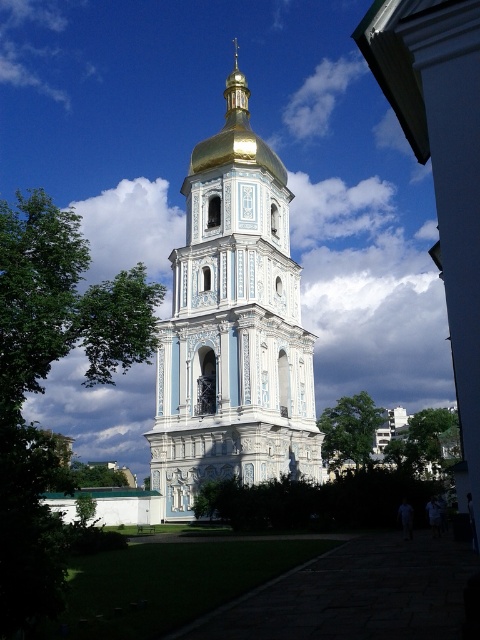
You are standing in front of the bell tower and want to take a photo that includes both the golden dome and the green leafy tree at center. Given that your camera has a maximum zoom range of 100 feet, can you capture both elements in the same frame without moving closer?

The green leafy tree at center is 288.00 feet away from the viewer. Since the camera can only zoom up to 100 feet, it cannot capture both the golden dome and the green leafy tree at center in the same frame without moving closer.

You are standing at the base of the light blue bell tower with the golden dome. You want to take a photo that includes both the green leafy tree at left and the golden dome. Which direction should you face to ensure both are in the frame?

The green leafy tree at left is located at point [46,376], so you should face towards the left side to include both the tree and the golden dome in your photo.